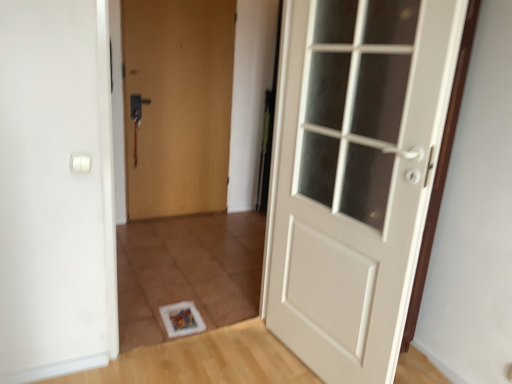
Question: Considering their positions, is white glossy door at center, which is the second door in left-to-right order, located in front of or behind matte wood door at center, which is the 2th door from right to left?

Choices:
 (A) behind
 (B) front

Answer: (B)

Question: Is white glossy door at center, which ranks as the first door in front-to-back order, inside or outside of matte wood door at center, arranged as the 1th door when viewed from the left?

Choices:
 (A) inside
 (B) outside

Answer: (B)

Question: Considering the positions of point (415, 196) and point (133, 160), is point (415, 196) closer or farther from the camera than point (133, 160)?

Choices:
 (A) farther
 (B) closer

Answer: (B)

Question: Is matte wood door at center, which is the 2th door from right to left, in front of or behind white glossy door at center, which is the first door from right to left, in the image?

Choices:
 (A) front
 (B) behind

Answer: (B)

Question: From their relative heights in the image, would you say matte wood door at center, which is the 1th door from back to front, is taller or shorter than white glossy door at center, which is the second door in left-to-right order?

Choices:
 (A) short
 (B) tall

Answer: (B)

Question: Would you say matte wood door at center, which is the 2th door from right to left, is to the left or to the right of white glossy door at center, which ranks as the first door in front-to-back order, in the picture?

Choices:
 (A) right
 (B) left

Answer: (B)

Question: Looking at their shapes, would you say matte wood door at center, which is the 2th door from right to left, is wider or thinner than white glossy door at center, which is the first door from right to left?

Choices:
 (A) thin
 (B) wide

Answer: (A)